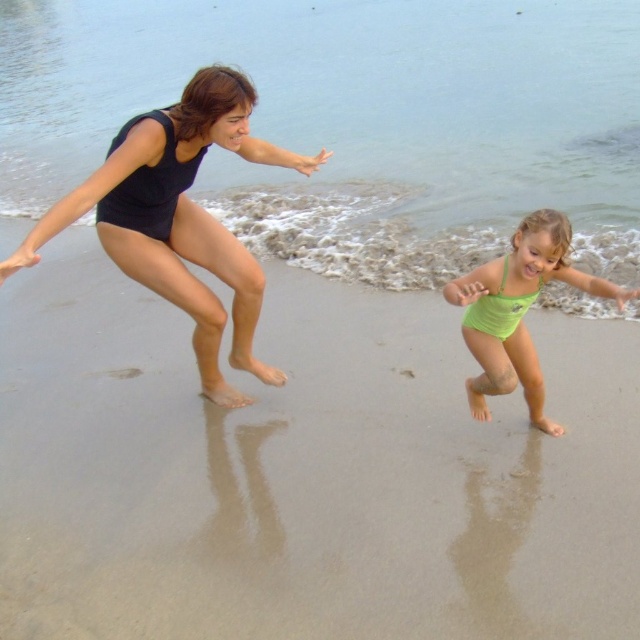
Question: Which of the following is the closest to the observer?

Choices:
 (A) smooth tan sand at center
 (B) green matte swimsuit at center

Answer: (A)

Question: Which object appears closest to the camera in this image?

Choices:
 (A) smooth tan sand at center
 (B) clear blue water at center

Answer: (A)

Question: Where is matte black swimsuit at left located in relation to green matte swimsuit at center in the image?

Choices:
 (A) right
 (B) left

Answer: (B)

Question: Which object appears closest to the camera in this image?

Choices:
 (A) green matte swimsuit at center
 (B) matte black swimsuit at left
 (C) smooth tan sand at center
 (D) clear blue water at center

Answer: (C)

Question: Can you confirm if clear blue water at center is smaller than green matte swimsuit at center?

Choices:
 (A) yes
 (B) no

Answer: (B)

Question: Does clear blue water at center have a greater width compared to green matte swimsuit at center?

Choices:
 (A) yes
 (B) no

Answer: (A)